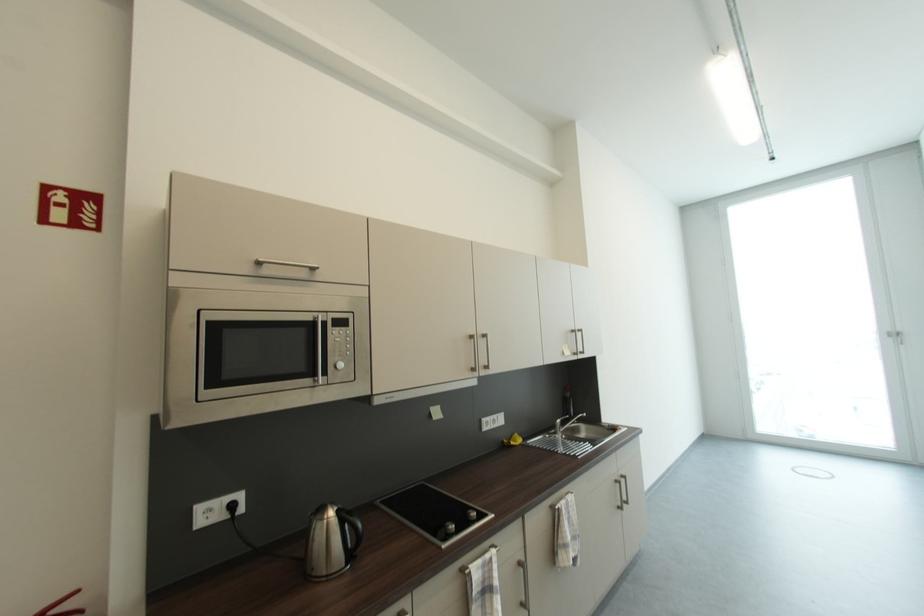
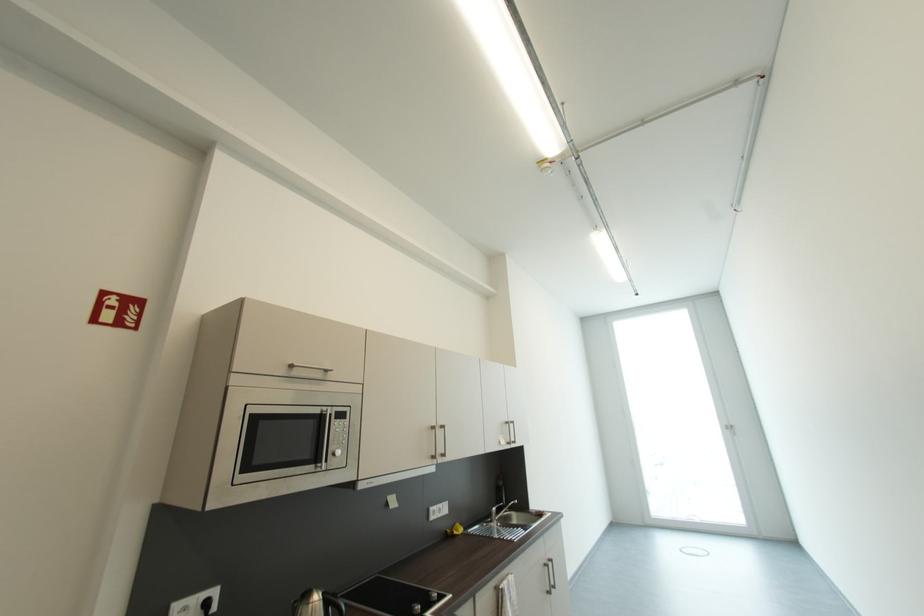
The point at (475, 513) is marked in the first image. Where is the corresponding point in the second image?

(435, 594)